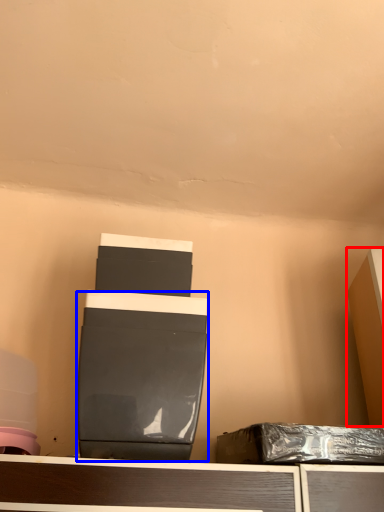
Question: Which of the following is the closest to the observer, furniture (highlighted by a red box) or wide (highlighted by a blue box)?

Choices:
 (A) furniture
 (B) wide

Answer: (B)